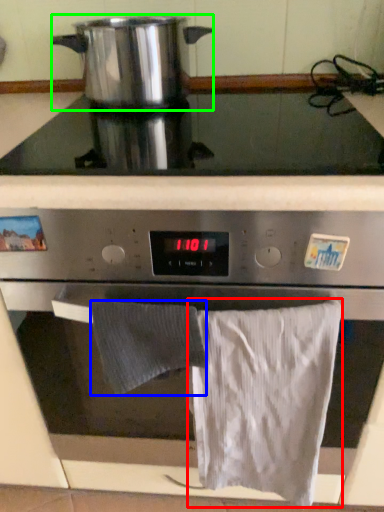
Question: Based on their relative distances, which object is nearer to bath towel (highlighted by a red box)? Choose from bath towel (highlighted by a blue box) and kitchen appliance (highlighted by a green box).

Choices:
 (A) bath towel
 (B) kitchen appliance

Answer: (A)